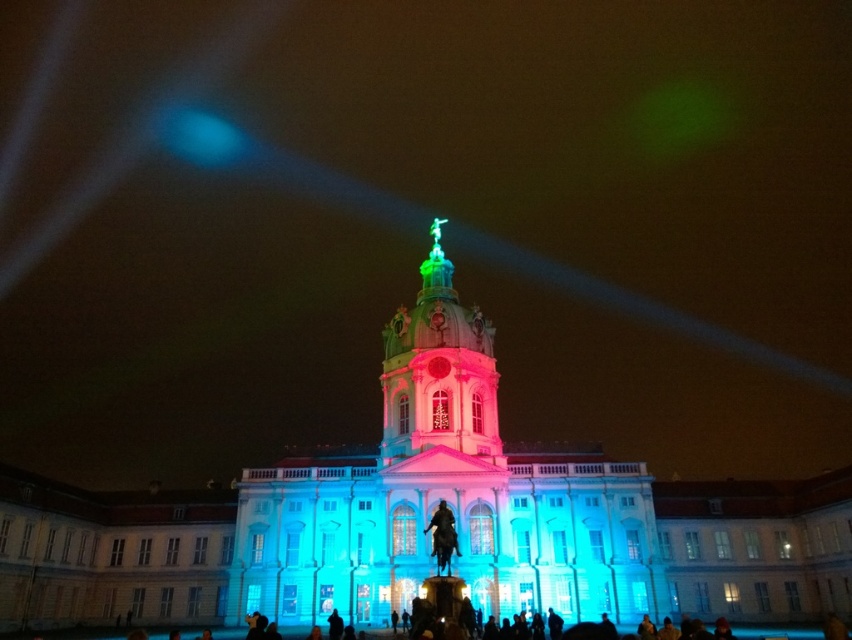
Between polished stone tower at center and shiny green dome at center, which one is positioned higher?

shiny green dome at center is higher up.

Does polished stone tower at center have a larger size compared to shiny green dome at center?

Yes, polished stone tower at center is bigger than shiny green dome at center.

Locate an element on the screen. The width and height of the screenshot is (852, 640). polished stone tower at center is located at coordinates (444, 497).

You are a GUI agent. You are given a task and a screenshot of the screen. Output one action in this format:
    pyautogui.click(x=<x>, y=<y>)
    Task: Click on the polished stone tower at center
    
    Given the screenshot: What is the action you would take?
    pyautogui.click(x=444, y=497)